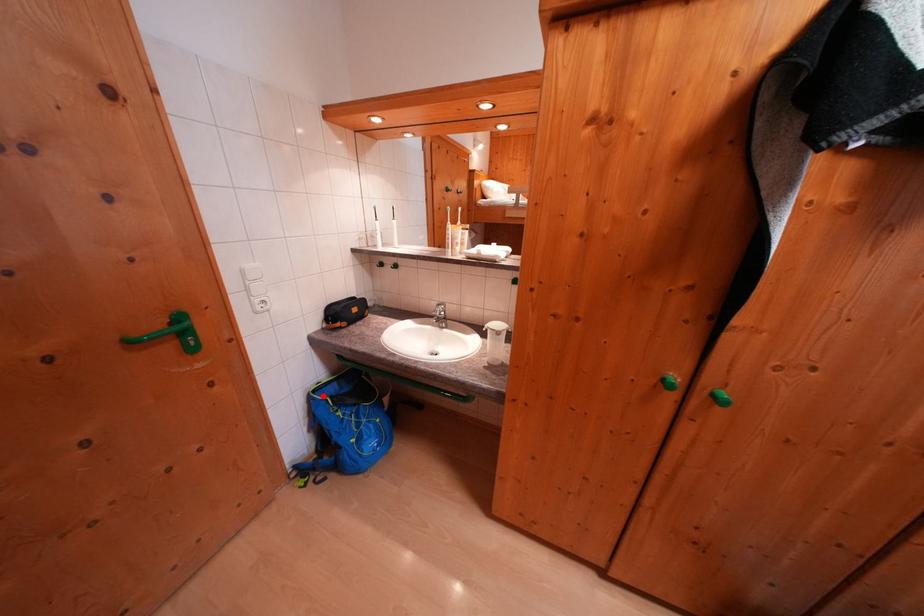
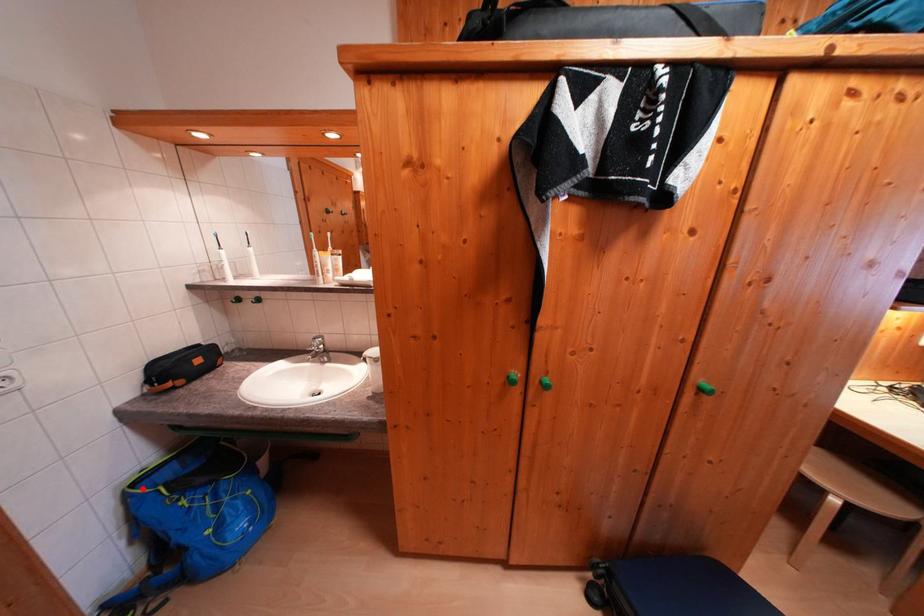
I am providing you with two images of the same scene from different viewpoints. A red point is marked on the first image and another point is marked on the second image. Are the points marked in image1 and image2 representing the same 3D position?

Yes